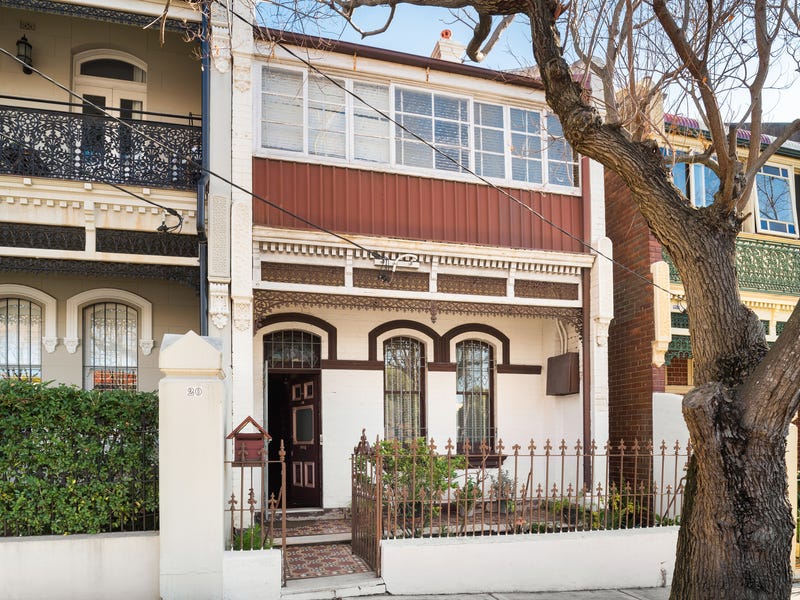
This screenshot has width=800, height=600. What are the coordinates of `pillar` in the screenshot? It's located at (205, 436).